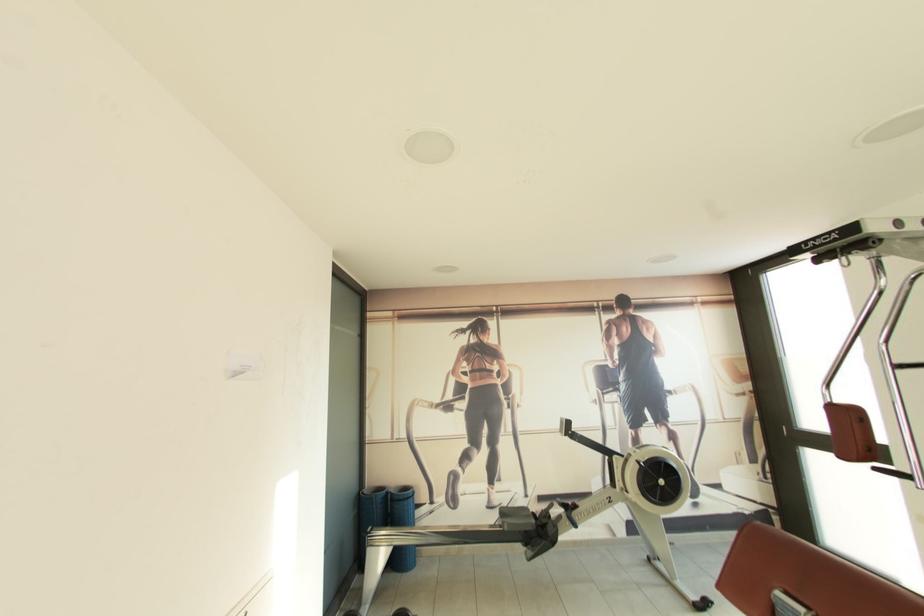
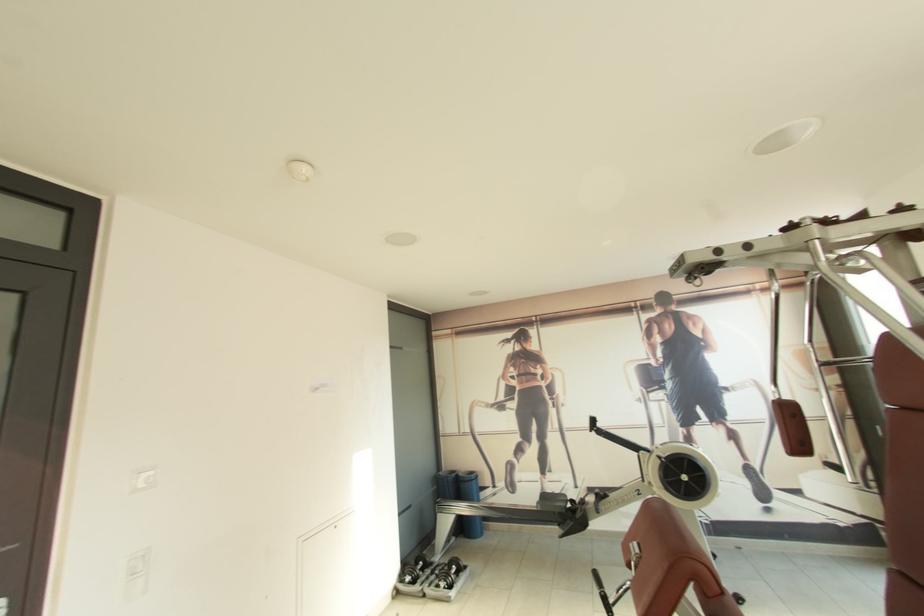
Locate, in the second image, the point that corresponds to point 371,493 in the first image.

(445, 475)